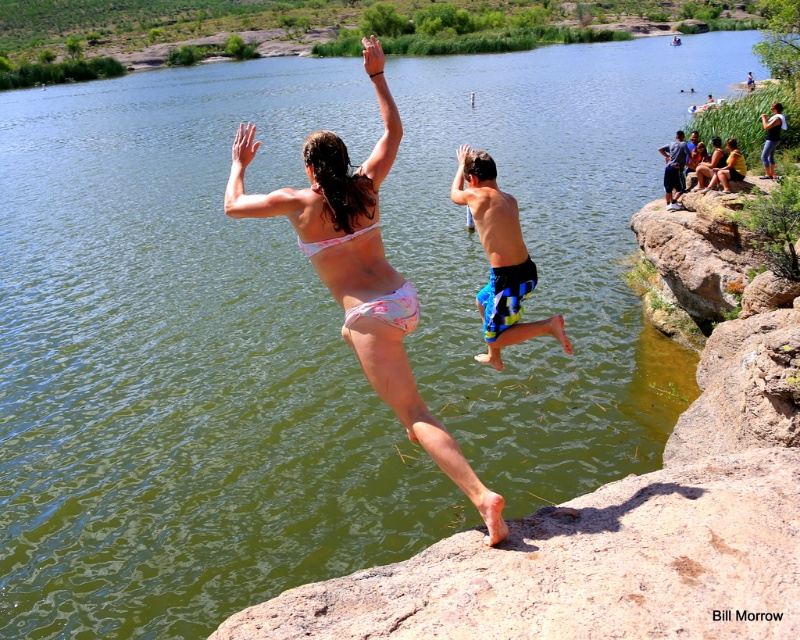
Is point (668, 202) more distant than point (768, 154)?

No, it is not.

Between dark blue shorts at right and denim shorts at upper right, which one has less height?

With less height is denim shorts at upper right.

The image size is (800, 640). What do you see at coordinates (674, 168) in the screenshot?
I see `dark blue shorts at right` at bounding box center [674, 168].

Find the location of `dark blue shorts at right`. dark blue shorts at right is located at coordinates tap(674, 168).

Does point (660, 148) lie in front of point (352, 234)?

No, it is behind (352, 234).

Is point (672, 204) farther from camera compared to point (297, 237)?

Yes, it is.

Is point (686, 157) closer to camera compared to point (352, 230)?

No, it is behind (352, 230).

I want to click on dark blue shorts at right, so click(674, 168).

Is point (488, 246) positioned in front of point (312, 250)?

No, (488, 246) is further to viewer.

Is blue plaid shorts at center to the right of pink floral bikini top at center from the viewer's perspective?

Correct, you'll find blue plaid shorts at center to the right of pink floral bikini top at center.

Find the location of a particular element. blue plaid shorts at center is located at coordinates (500, 257).

Locate an element on the screen. blue plaid shorts at center is located at coordinates (500, 257).